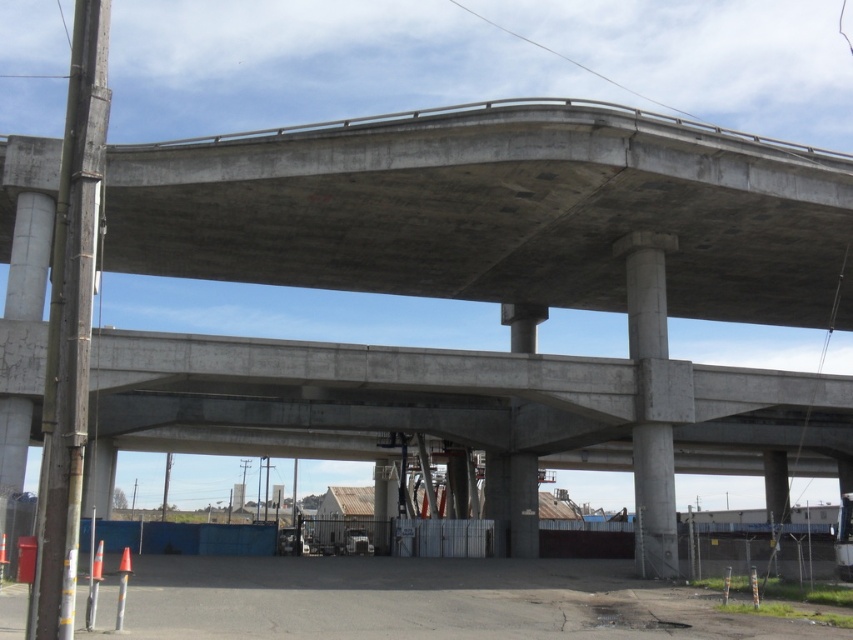
Question: Considering the relative positions of concrete pole at left and gray concrete pillar at center in the image provided, where is concrete pole at left located with respect to gray concrete pillar at center?

Choices:
 (A) right
 (B) left

Answer: (B)

Question: Which object is positioned farthest from the concrete highway at lower center?

Choices:
 (A) concrete pole at left
 (B) concrete/rough column at center
 (C) gray concrete pillar at center

Answer: (C)

Question: Among these objects, which one is farthest from the camera?

Choices:
 (A) concrete/rough column at center
 (B) concrete highway at lower center
 (C) concrete pole at left
 (D) gray concrete pillar at center

Answer: (D)

Question: Is concrete pole at left above concrete/rough column at center?

Choices:
 (A) no
 (B) yes

Answer: (B)

Question: Which point is closer to the camera?

Choices:
 (A) (250, 582)
 (B) (61, 564)
 (C) (616, 243)

Answer: (B)

Question: From the image, what is the correct spatial relationship of concrete highway at lower center in relation to concrete/rough column at center?

Choices:
 (A) left
 (B) right

Answer: (A)